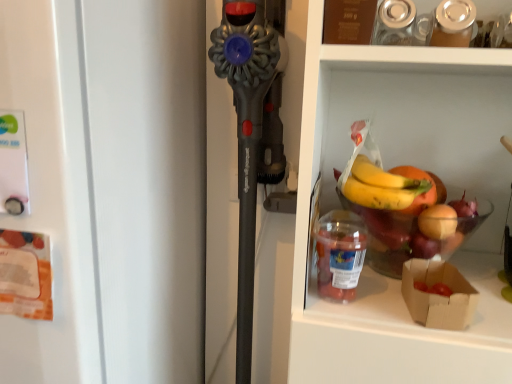
Question: Is brown paper bag at lower right bigger or smaller than white matte refrigerator at left?

Choices:
 (A) small
 (B) big

Answer: (A)

Question: From the image's perspective, is brown paper bag at lower right located above or below white matte refrigerator at left?

Choices:
 (A) above
 (B) below

Answer: (A)

Question: Which object is positioned closest to the brown paper bag at lower right?

Choices:
 (A) white matte refrigerator at left
 (B) translucent plastic container at lower right

Answer: (B)

Question: Considering the real-world distances, which object is closest to the translucent plastic container at lower right?

Choices:
 (A) brown paper bag at lower right
 (B) white matte refrigerator at left

Answer: (A)